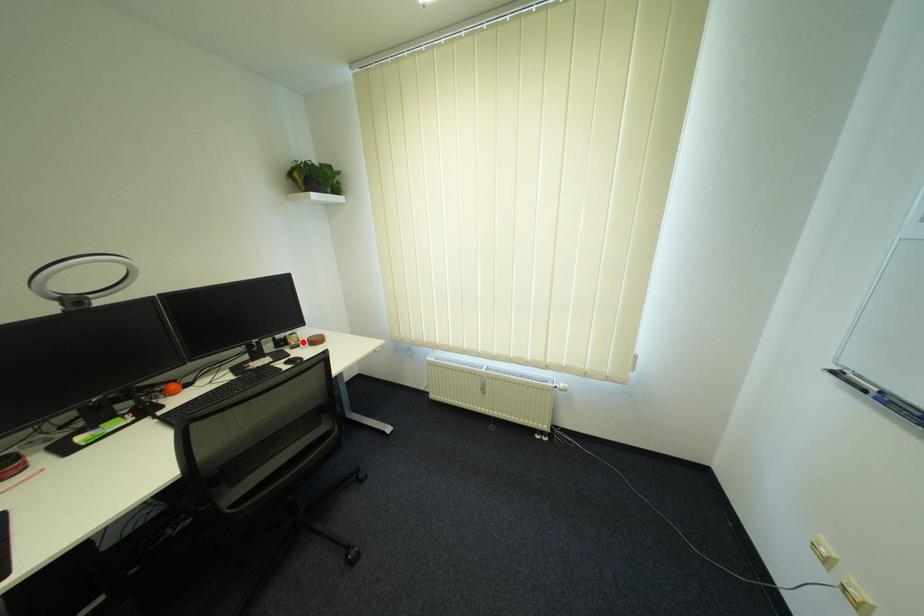
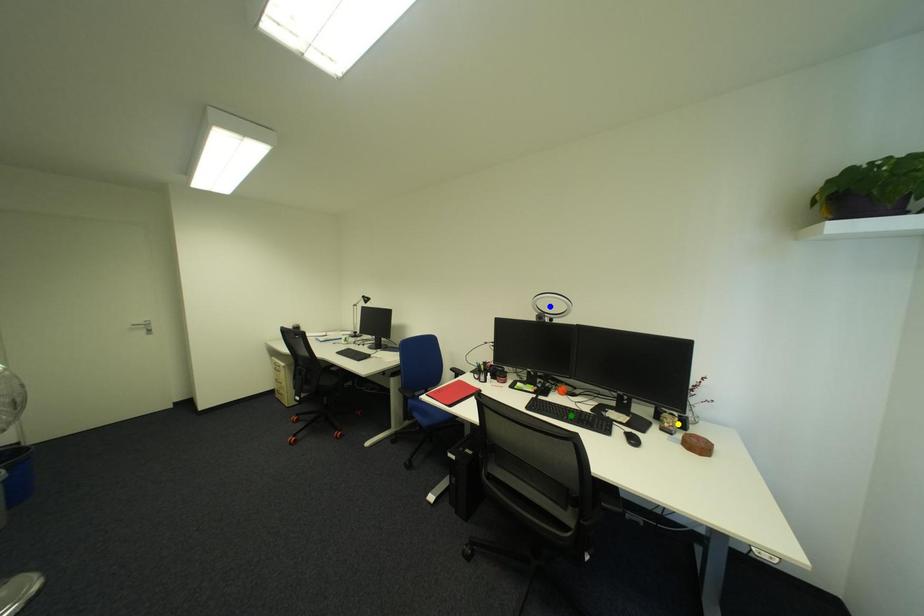
Question: I am providing you with two images of the same scene from different viewpoints. A red point is marked on the first image. You are given multiple points on the second image. Which point in image 2 is actually the same real-world point as the red point in image 1?

Choices:
 (A) blue point
 (B) yellow point
 (C) green point

Answer: (B)